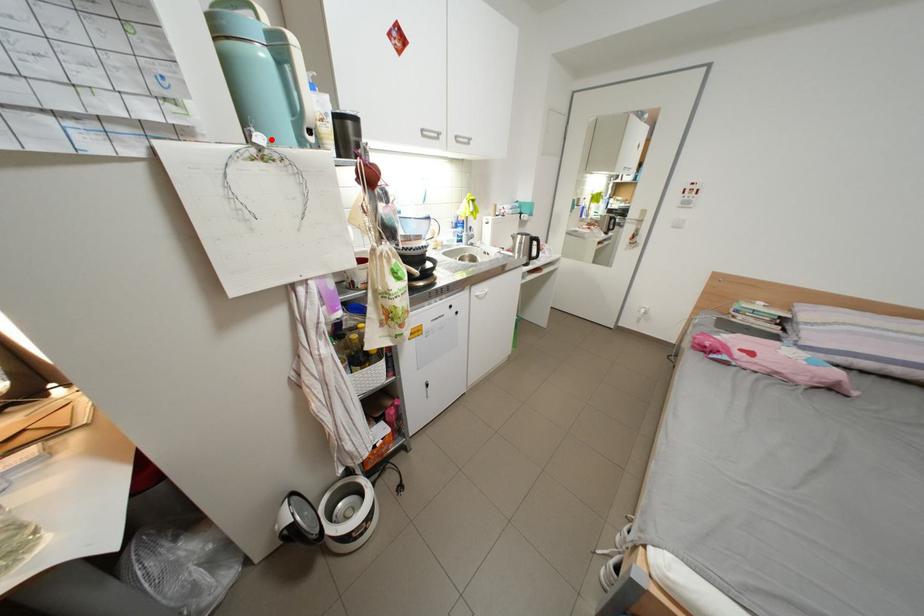
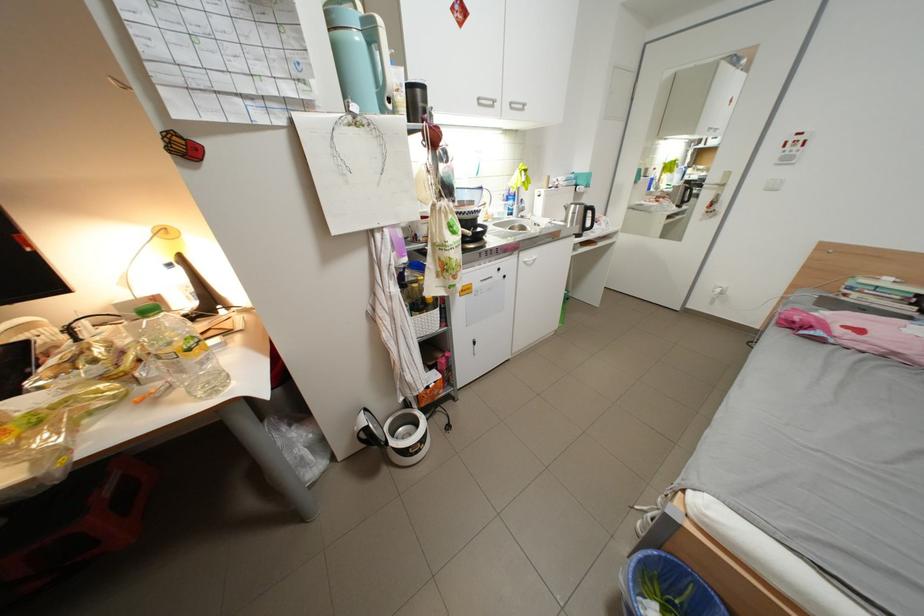
In the second image, find the point that corresponds to the highlighted location in the first image.

(367, 108)